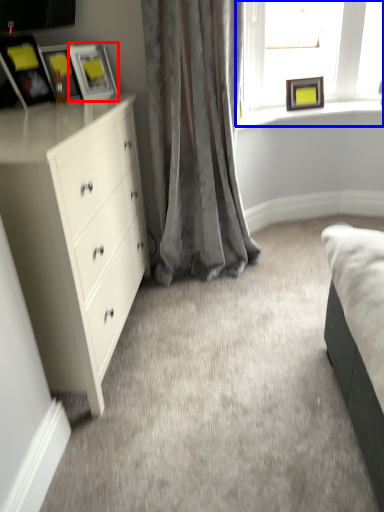
Question: Which point is closer to the camera, picture frame (highlighted by a red box) or window (highlighted by a blue box)?

Choices:
 (A) picture frame
 (B) window

Answer: (A)